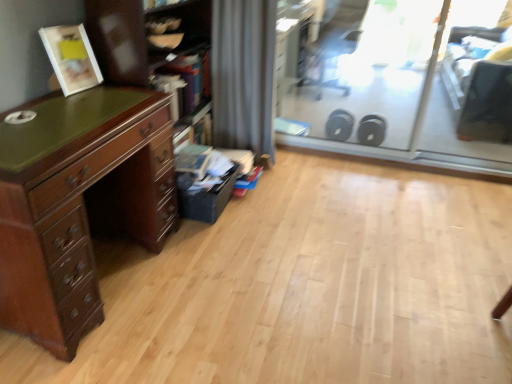
Question: Is wooden bookshelf at left at the right side of black plastic swivel chair at upper right?

Choices:
 (A) no
 (B) yes

Answer: (A)

Question: From the image's perspective, is wooden bookshelf at left under black plastic swivel chair at upper right?

Choices:
 (A) no
 (B) yes

Answer: (B)

Question: From a real-world perspective, does wooden bookshelf at left sit lower than black plastic swivel chair at upper right?

Choices:
 (A) yes
 (B) no

Answer: (B)

Question: Is wooden bookshelf at left positioned with its back to black plastic swivel chair at upper right?

Choices:
 (A) no
 (B) yes

Answer: (A)

Question: Considering the relative sizes of wooden bookshelf at left and black plastic swivel chair at upper right in the image provided, is wooden bookshelf at left smaller than black plastic swivel chair at upper right?

Choices:
 (A) yes
 (B) no

Answer: (B)

Question: Would you say gray fabric curtain at center is to the left or to the right of transparent plastic screen door at upper right, which is the second screen door from left to right, in the picture?

Choices:
 (A) left
 (B) right

Answer: (A)

Question: Looking at their shapes, would you say gray fabric curtain at center is wider or thinner than transparent plastic screen door at upper right, which is the second screen door from left to right?

Choices:
 (A) thin
 (B) wide

Answer: (B)

Question: Relative to transparent plastic screen door at upper right, acting as the 1th screen door starting from the right, is gray fabric curtain at center in front or behind?

Choices:
 (A) front
 (B) behind

Answer: (B)

Question: Is gray fabric curtain at center situated inside transparent plastic screen door at upper right, acting as the 1th screen door starting from the right, or outside?

Choices:
 (A) inside
 (B) outside

Answer: (B)

Question: From a real-world perspective, is transparent plastic screen door at upper right, which is the second screen door from left to right, physically located above or below wooden bookshelf at left?

Choices:
 (A) above
 (B) below

Answer: (A)

Question: Does point (478, 157) appear closer or farther from the camera than point (126, 77)?

Choices:
 (A) closer
 (B) farther

Answer: (B)

Question: In terms of width, does transparent plastic screen door at upper right, acting as the 1th screen door starting from the right, look wider or thinner when compared to wooden bookshelf at left?

Choices:
 (A) thin
 (B) wide

Answer: (A)

Question: Is transparent plastic screen door at upper right, acting as the 1th screen door starting from the right, inside or outside of wooden bookshelf at left?

Choices:
 (A) outside
 (B) inside

Answer: (A)

Question: Relative to wooden bookshelf at left, is transparent glass screen door at upper right, the first screen door positioned from the left, in front or behind?

Choices:
 (A) front
 (B) behind

Answer: (B)

Question: Do you think transparent glass screen door at upper right, the first screen door positioned from the left, is within wooden bookshelf at left, or outside of it?

Choices:
 (A) inside
 (B) outside

Answer: (B)